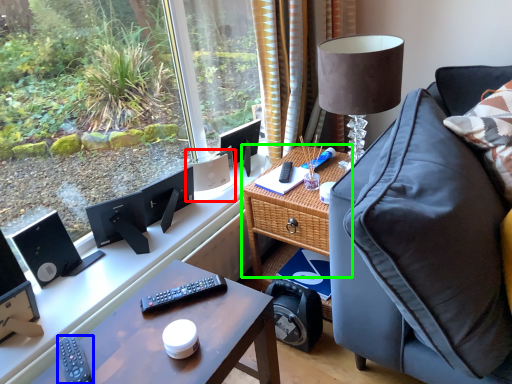
Question: Estimate the real-world distances between objects in this image. Which object is closer to speaker (highlighted by a red box), remote control (highlighted by a blue box) or table (highlighted by a green box)?

Choices:
 (A) remote control
 (B) table

Answer: (B)